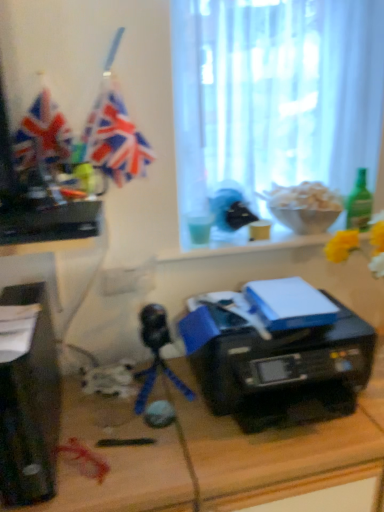
Question: Is white sheer curtain at upper center facing towards green glass bottle at right?

Choices:
 (A) yes
 (B) no

Answer: (A)

Question: From a real-world perspective, is white sheer curtain at upper center located beneath green glass bottle at right?

Choices:
 (A) no
 (B) yes

Answer: (A)

Question: Is white sheer curtain at upper center shorter than green glass bottle at right?

Choices:
 (A) no
 (B) yes

Answer: (A)

Question: Is white sheer curtain at upper center thinner than green glass bottle at right?

Choices:
 (A) yes
 (B) no

Answer: (B)

Question: Is white sheer curtain at upper center smaller than green glass bottle at right?

Choices:
 (A) yes
 (B) no

Answer: (B)

Question: Considering the relative sizes of white sheer curtain at upper center and green glass bottle at right in the image provided, is white sheer curtain at upper center wider than green glass bottle at right?

Choices:
 (A) no
 (B) yes

Answer: (B)

Question: Is green glass bottle at right wider than white sheer curtain at upper center?

Choices:
 (A) no
 (B) yes

Answer: (A)

Question: Can you confirm if green glass bottle at right is thinner than white sheer curtain at upper center?

Choices:
 (A) no
 (B) yes

Answer: (B)

Question: Is the depth of green glass bottle at right greater than that of white sheer curtain at upper center?

Choices:
 (A) no
 (B) yes

Answer: (B)

Question: From a real-world perspective, is green glass bottle at right on top of white sheer curtain at upper center?

Choices:
 (A) yes
 (B) no

Answer: (B)

Question: Is green glass bottle at right aimed at white sheer curtain at upper center?

Choices:
 (A) no
 (B) yes

Answer: (A)

Question: Is green glass bottle at right at the right side of white sheer curtain at upper center?

Choices:
 (A) no
 (B) yes

Answer: (B)

Question: Would you consider green glass bottle at right to be distant from black plastic desktop computer at left?

Choices:
 (A) yes
 (B) no

Answer: (A)